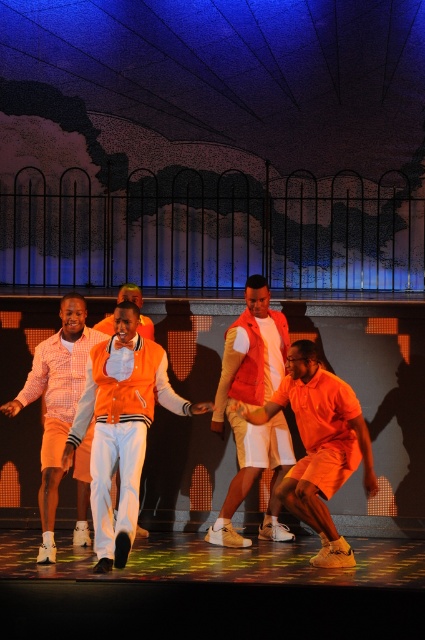
Is orange velvety jacket at center positioned in front of orange matte vest at center?

Yes, it is.

Does orange velvety jacket at center have a larger size compared to orange matte vest at center?

Indeed, orange velvety jacket at center has a larger size compared to orange matte vest at center.

The width and height of the screenshot is (425, 640). Find the location of `orange velvety jacket at center`. orange velvety jacket at center is located at coordinates (121, 426).

Locate an element on the screen. This screenshot has width=425, height=640. orange velvety jacket at center is located at coordinates (121, 426).

Which is below, orange velvety jacket at center or orange matte shirt at center?

Positioned lower is orange matte shirt at center.

Is point (152, 356) in front of point (311, 449)?

No, (152, 356) is behind (311, 449).

You are a GUI agent. You are given a task and a screenshot of the screen. Output one action in this format:
    pyautogui.click(x=<x>, y=<y>)
    Task: Click on the orange velvety jacket at center
    Image resolution: width=425 pixels, height=640 pixels.
    Given the screenshot: What is the action you would take?
    pyautogui.click(x=121, y=426)

Does orange matte shirt at center have a greater height compared to orange matte vest at center?

No, orange matte shirt at center is not taller than orange matte vest at center.

Does point (368, 472) come behind point (237, 397)?

No, (368, 472) is closer to viewer.

Is point (306, 515) closer to viewer compared to point (226, 412)?

Yes, point (306, 515) is in front of point (226, 412).

At what (x,y) coordinates should I click in order to perform the action: click on orange matte shirt at center. Please return your answer as a coordinate pair (x, y). This screenshot has height=640, width=425. Looking at the image, I should click on (320, 445).